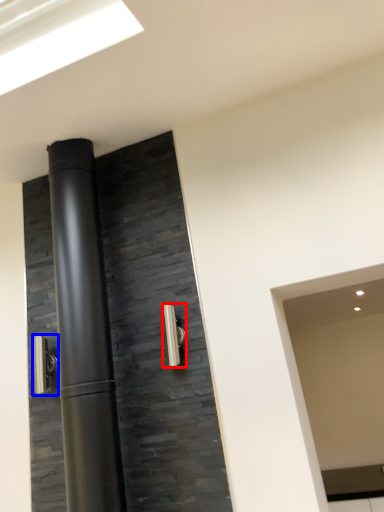
Question: Which object is closer to the camera taking this photo, door handle (highlighted by a red box) or door handle (highlighted by a blue box)?

Choices:
 (A) door handle
 (B) door handle

Answer: (A)